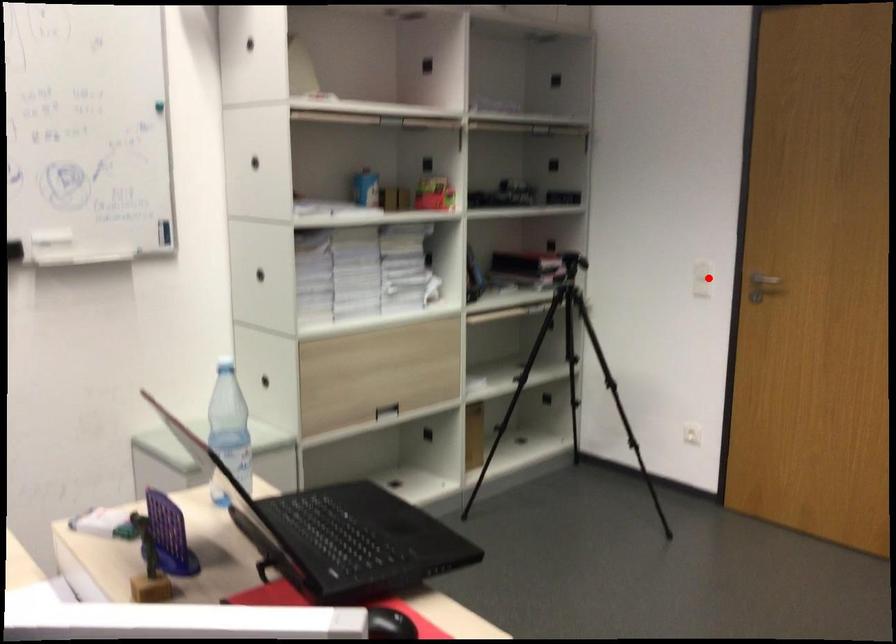
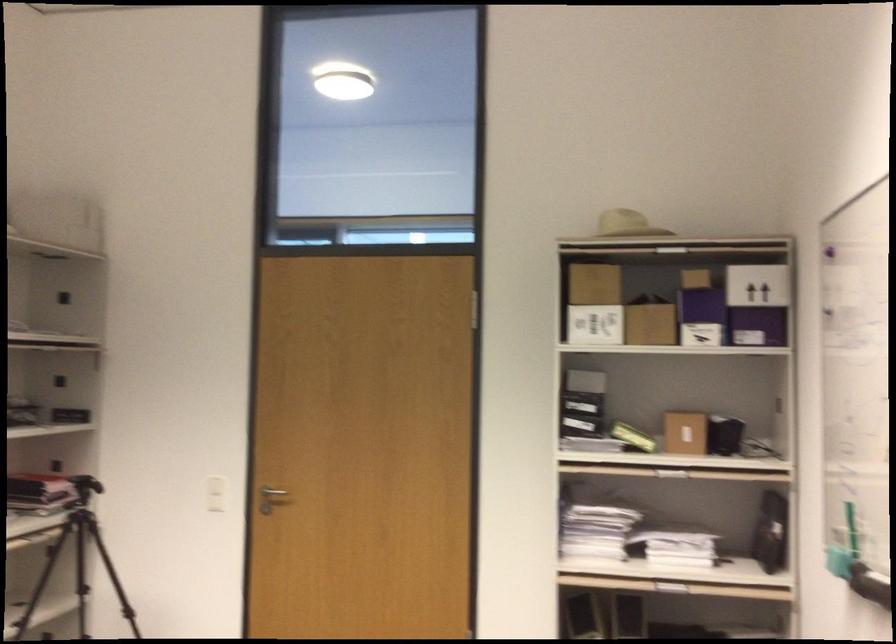
Find the pixel in the second image that matches the highlighted location in the first image.

(216, 494)